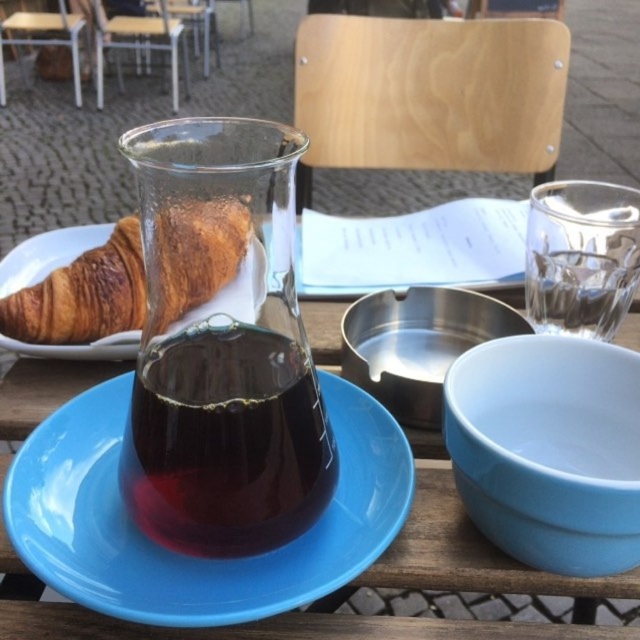
Is blue ceramic saucer at center to the right of golden brown croissant at center from the viewer's perspective?

Correct, you'll find blue ceramic saucer at center to the right of golden brown croissant at center.

Can you confirm if blue ceramic saucer at center is taller than golden brown croissant at center?

No, blue ceramic saucer at center is not taller than golden brown croissant at center.

Identify the location of blue ceramic saucer at center. This screenshot has height=640, width=640. (189, 556).

At what (x,y) coordinates should I click in order to perform the action: click on blue ceramic saucer at center. Please return your answer as a coordinate pair (x, y). Looking at the image, I should click on (189, 556).

Image resolution: width=640 pixels, height=640 pixels. Describe the element at coordinates (548, 449) in the screenshot. I see `light blue ceramic bowl at right` at that location.

Which is more to the left, light blue ceramic bowl at right or shiny metallic bowl at center?

shiny metallic bowl at center is more to the left.

Where is `light blue ceramic bowl at right`? light blue ceramic bowl at right is located at coordinates (548, 449).

Can you confirm if blue ceramic saucer at center is positioned to the left of transparent glass carafe at center?

Yes, blue ceramic saucer at center is to the left of transparent glass carafe at center.

Does blue ceramic saucer at center appear over transparent glass carafe at center?

Incorrect, blue ceramic saucer at center is not positioned above transparent glass carafe at center.

Find the location of a particular element. blue ceramic saucer at center is located at coordinates (189, 556).